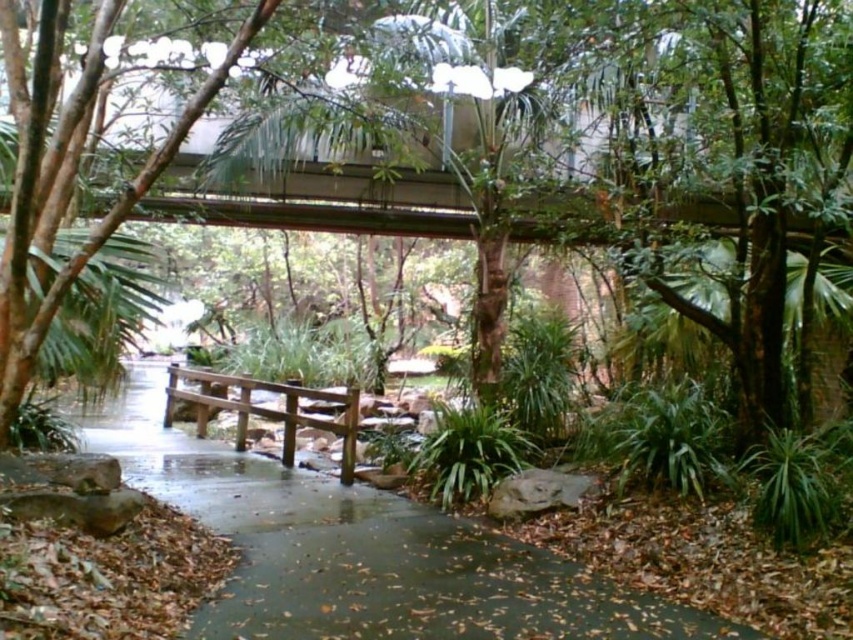
The height and width of the screenshot is (640, 853). Find the location of `green leafy tree at center`. green leafy tree at center is located at coordinates (599, 150).

Does green leafy tree at center have a larger size compared to brown wooden bench at center?

No.

Locate an element on the screen. Image resolution: width=853 pixels, height=640 pixels. green leafy tree at center is located at coordinates (599, 150).

The image size is (853, 640). I want to click on green leafy tree at center, so click(599, 150).

Can you confirm if green leafy tree at center is positioned to the left of brown wooden bridge at center?

Incorrect, green leafy tree at center is not on the left side of brown wooden bridge at center.

Identify the location of green leafy tree at center. Image resolution: width=853 pixels, height=640 pixels. (599, 150).

Locate an element on the screen. green leafy tree at center is located at coordinates (599, 150).

Who is positioned more to the left, brown wooden bridge at center or brown wooden bench at center?

Answer: brown wooden bench at center is more to the left.

The image size is (853, 640). Find the location of `brown wooden bridge at center`. brown wooden bridge at center is located at coordinates (361, 550).

Find the location of a particular element. The width and height of the screenshot is (853, 640). brown wooden bridge at center is located at coordinates (361, 550).